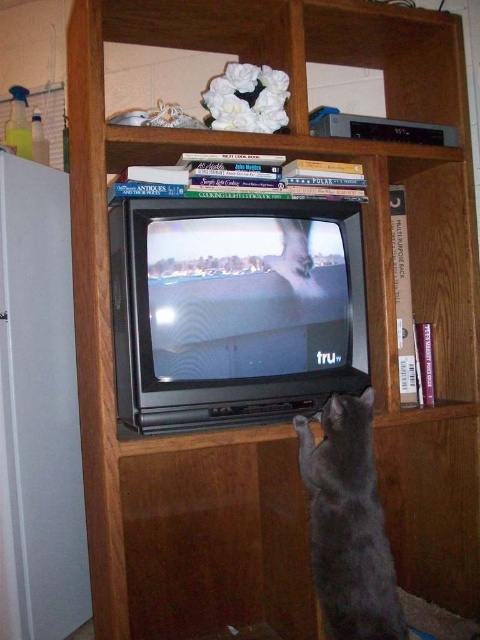
You are standing in front of the entertainment unit and want to reach the point at coordinates point [36,273]. Can you estimate if you can comfortably reach that point without needing a stool?

The distance between the point [36,273] and the viewer is 4.43 feet. Since this distance is within a typical comfortable reaching range for most adults, you can likely reach it without needing a stool.

What object is located at the coordinates point (38, 410)?

The point (38, 410) corresponds to the matte white refrigerator at left.